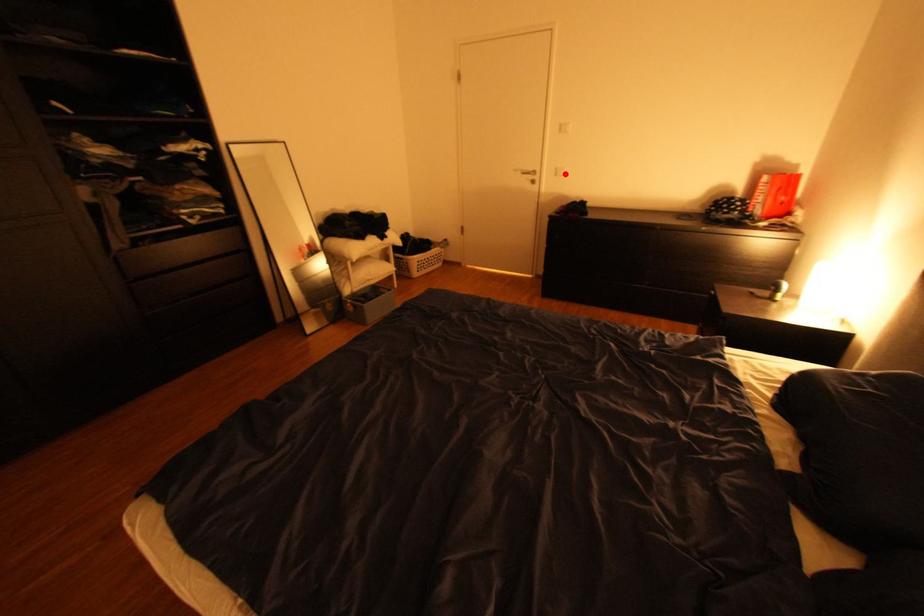
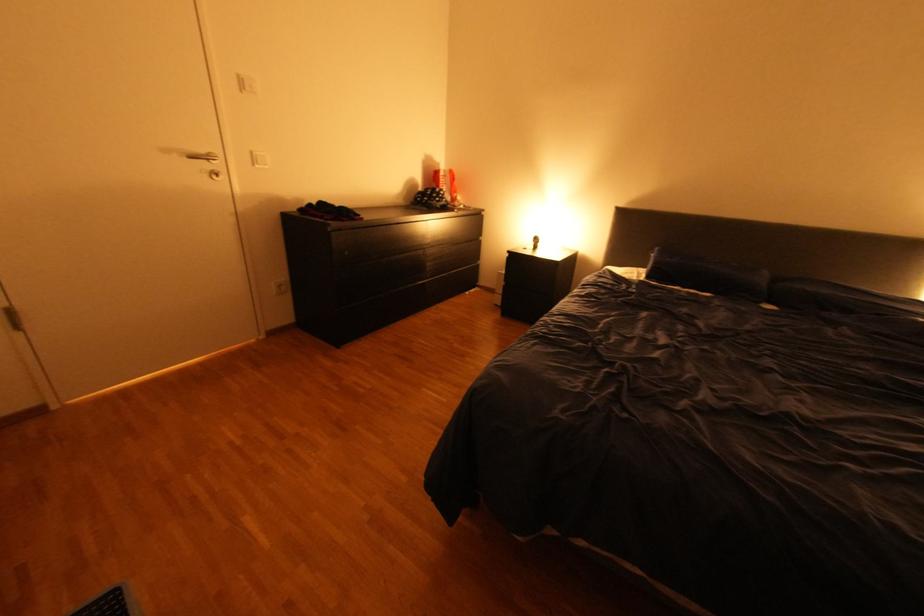
Question: I am providing you with two images of the same scene from different viewpoints. In image1, a red point is highlighted. Considering the same 3D point in image2, which of the following is correct?

Choices:
 (A) It is closer
 (B) It is farther

Answer: (B)